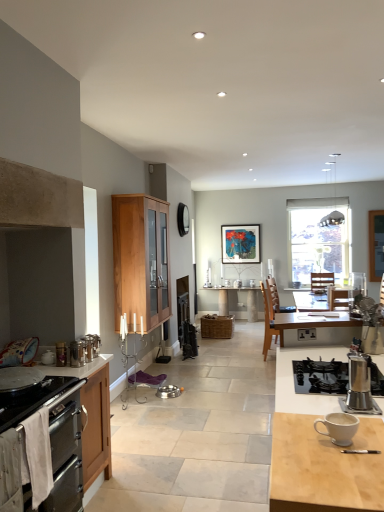
Locate an element on the screen. This screenshot has width=384, height=512. vacant space in front of metallic stainless steel pet bowls at center, the 2th kitchen appliance from the top is located at coordinates (165, 402).